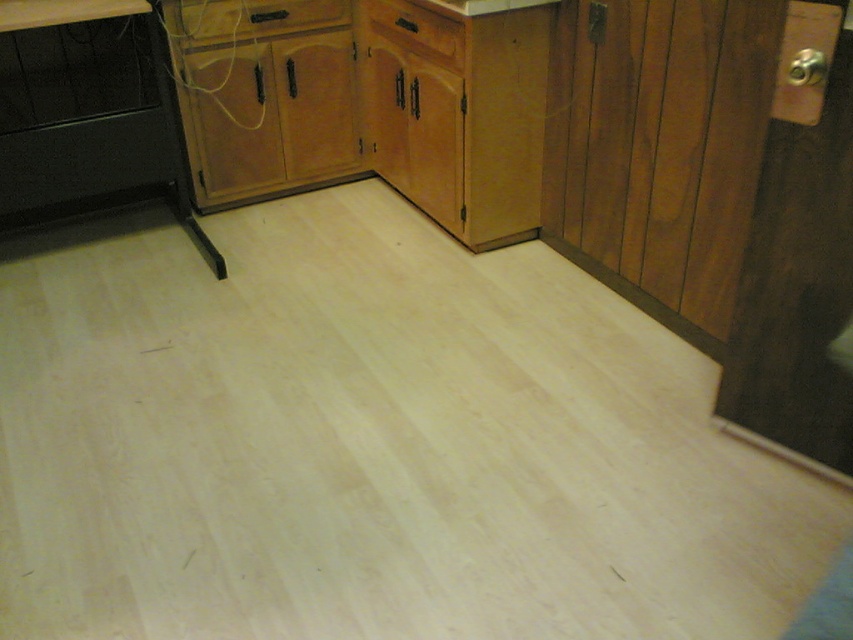
Who is lower down, black matte stove at left or white laminate counter top at upper left?

black matte stove at left is lower down.

Can you confirm if black matte stove at left is positioned above white laminate counter top at upper left?

No.

You are a GUI agent. You are given a task and a screenshot of the screen. Output one action in this format:
    pyautogui.click(x=<x>, y=<y>)
    Task: Click on the black matte stove at left
    The height and width of the screenshot is (640, 853).
    Given the screenshot: What is the action you would take?
    pyautogui.click(x=88, y=122)

Identify the location of black matte stove at left. (88, 122).

Is black matte stove at left positioned at the back of wooden drawer at upper center?

No, black matte stove at left is in front of wooden drawer at upper center.

Which is behind, point (123, 52) or point (167, 4)?

The point (123, 52) is behind.

Where is `black matte stove at left`? This screenshot has width=853, height=640. black matte stove at left is located at coordinates (88, 122).

Is wooden drawer at upper center thinner than white laminate counter top at upper left?

In fact, wooden drawer at upper center might be wider than white laminate counter top at upper left.

Between point (311, 0) and point (28, 22), which one is positioned in front?

Point (28, 22) is in front.

The width and height of the screenshot is (853, 640). In order to click on wooden drawer at upper center in this screenshot , I will do tap(250, 17).